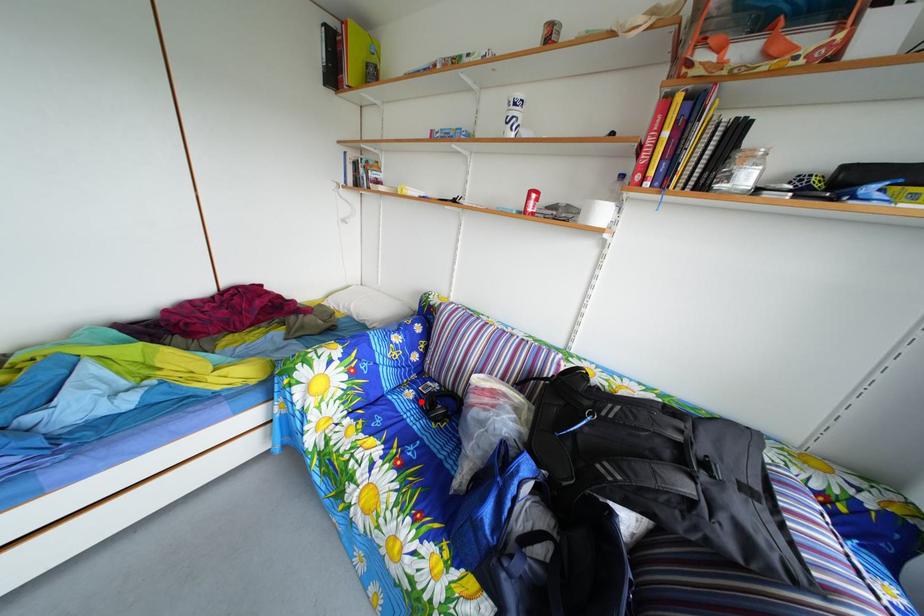
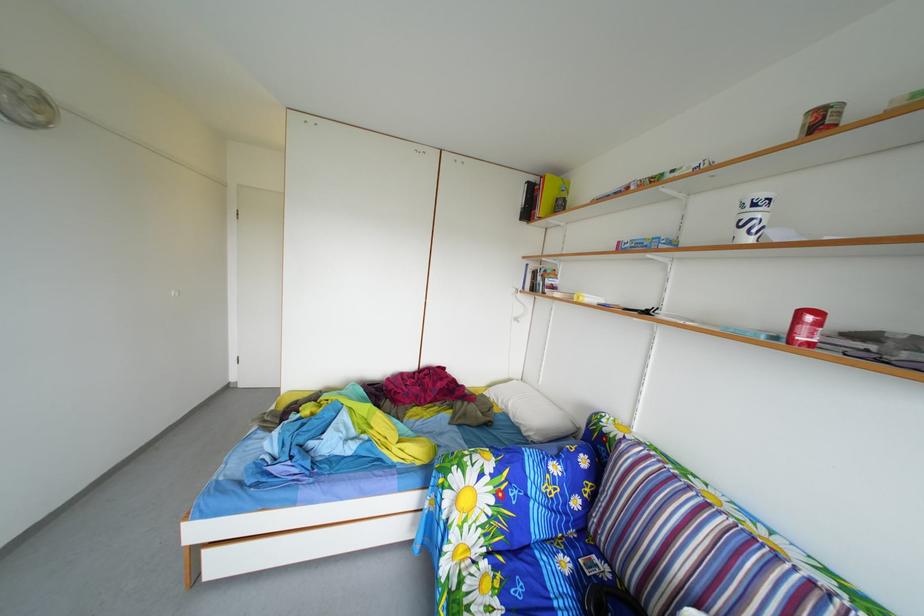
Locate, in the second image, the point that corresponds to the highlighted location in the first image.

(576, 570)